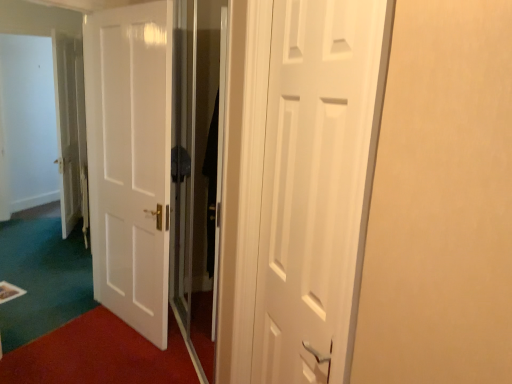
Question: Is transparent glass screen door at center inside the boundaries of white matte door at center, marked as the first door in a right-to-left arrangement, or outside?

Choices:
 (A) inside
 (B) outside

Answer: (B)

Question: Looking at the image, does transparent glass screen door at center seem bigger or smaller compared to white matte door at center, which appears as the second door when viewed from the back?

Choices:
 (A) small
 (B) big

Answer: (B)

Question: Which object is the farthest from the white matte door at center, which appears as the second door when viewed from the back?

Choices:
 (A) white glossy door at center, marked as the 1th door in a left-to-right arrangement
 (B) transparent glass screen door at center

Answer: (A)

Question: Which object is the farthest from the white glossy door at center, which appears as the first door when viewed from the back?

Choices:
 (A) transparent glass screen door at center
 (B) white matte door at center, marked as the first door in a right-to-left arrangement

Answer: (B)